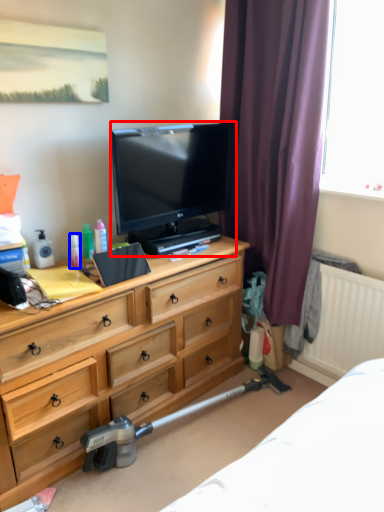
Question: Among these objects, which one is farthest to the camera, television (highlighted by a red box) or toiletry (highlighted by a blue box)?

Choices:
 (A) television
 (B) toiletry

Answer: (B)